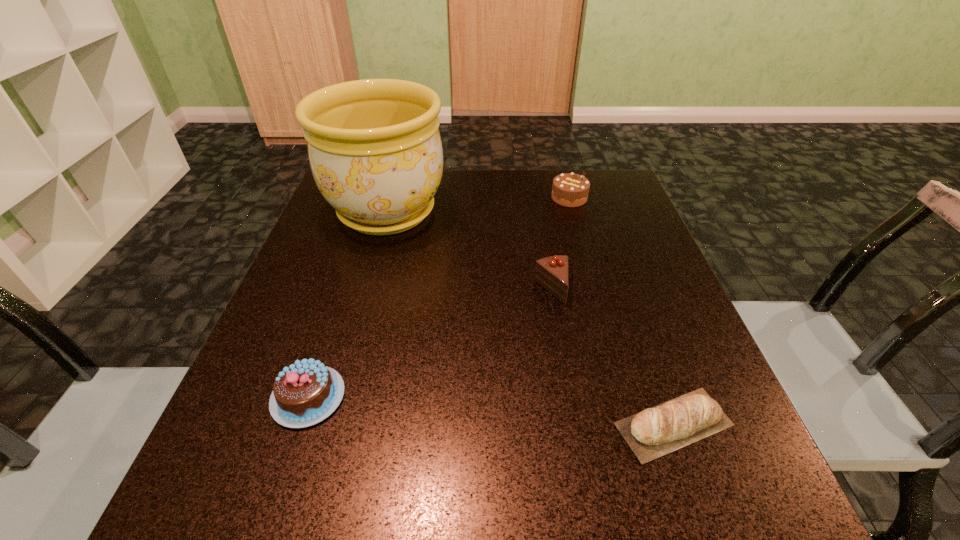
The image size is (960, 540). I want to click on vacant space that satisfies the following two spatial constraints: 1. on the front side of the second nearest chocolate cake; 2. on the right side of the flowerpot, so click(365, 289).

Find the location of a particular element. blank space that satisfies the following two spatial constraints: 1. on the front side of the third object from right to left; 2. on the left side of the shortest object is located at coordinates (575, 424).

In order to click on blank area in the image that satisfies the following two spatial constraints: 1. on the front side of the flowerpot; 2. on the left side of the shortest object in this screenshot , I will do `click(327, 424)`.

Locate an element on the screen. The width and height of the screenshot is (960, 540). vacant region that satisfies the following two spatial constraints: 1. on the front side of the shortest object; 2. on the right side of the flowerpot is located at coordinates (327, 424).

The image size is (960, 540). Identify the location of free spot that satisfies the following two spatial constraints: 1. on the front side of the second farthest chocolate cake; 2. on the left side of the shortest object. (575, 424).